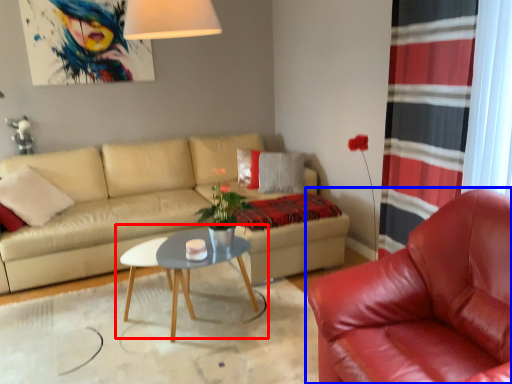
Question: Which object is further to the camera taking this photo, coffee table (highlighted by a red box) or chair (highlighted by a blue box)?

Choices:
 (A) coffee table
 (B) chair

Answer: (A)